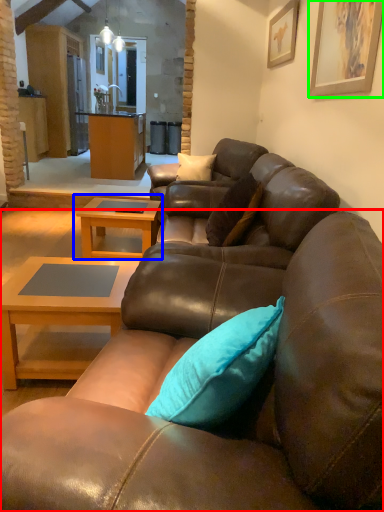
Question: Considering the real-world distances, which object is farthest from studio couch (highlighted by a red box)? coffee table (highlighted by a blue box) or picture frame (highlighted by a green box)?

Choices:
 (A) coffee table
 (B) picture frame

Answer: (A)